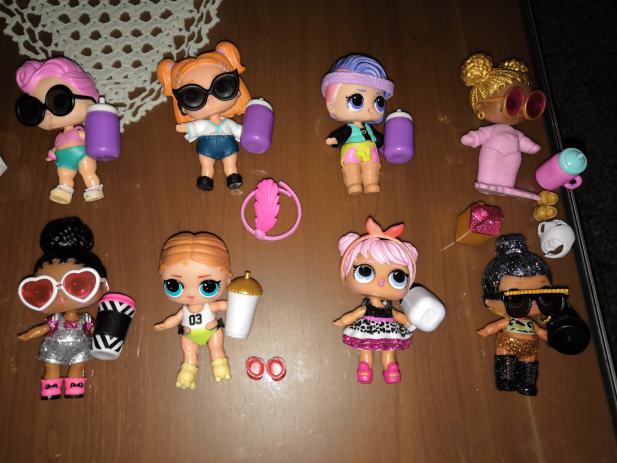
Identify the location of toy cup. (551, 176), (399, 141), (253, 133), (97, 133), (112, 328), (230, 305), (416, 318), (569, 343).